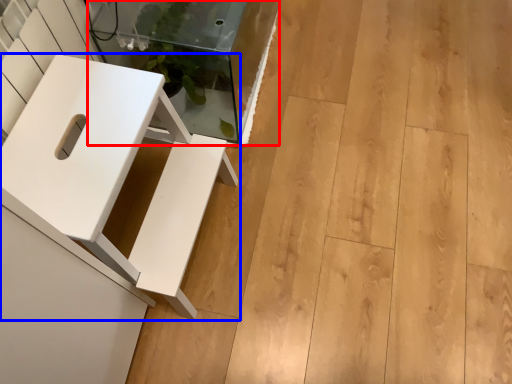
Question: Among these objects, which one is farthest to the camera, glass table (highlighted by a red box) or furniture (highlighted by a blue box)?

Choices:
 (A) glass table
 (B) furniture

Answer: (A)